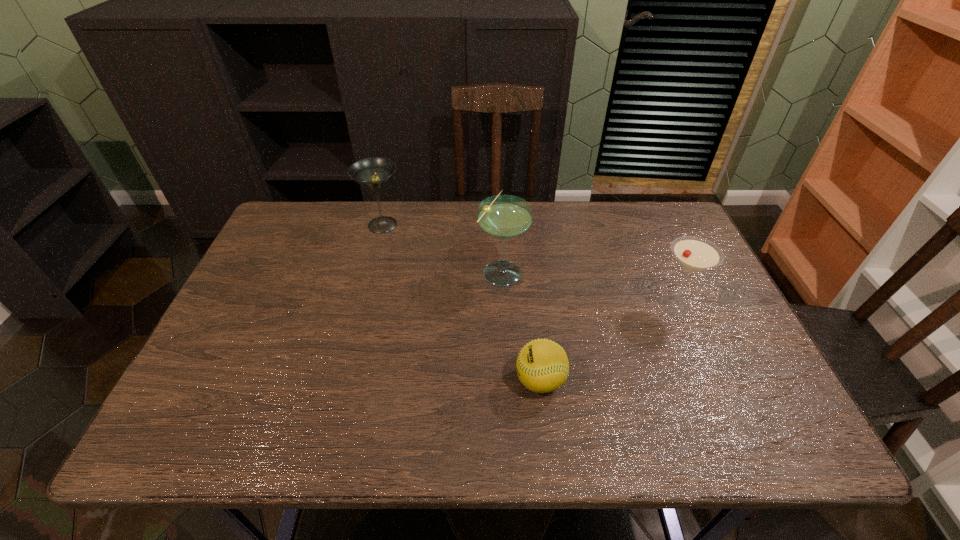
Identify the location of free spot at the near right corner of the desktop. The width and height of the screenshot is (960, 540). (742, 436).

The width and height of the screenshot is (960, 540). Find the location of `free space between the second martini from left to right and the shortest object`. free space between the second martini from left to right and the shortest object is located at coordinates (521, 326).

Locate an element on the screen. The image size is (960, 540). empty location between the nearest object and the leftmost martini is located at coordinates (461, 303).

Where is `vacant space that is in between the nearest object and the second martini from right to left`? vacant space that is in between the nearest object and the second martini from right to left is located at coordinates (521, 326).

Locate an element on the screen. This screenshot has width=960, height=540. unoccupied area between the second martini from right to left and the nearest object is located at coordinates (521, 326).

Find the location of a particular element. This screenshot has width=960, height=540. vacant region between the nearest object and the leftmost object is located at coordinates (461, 303).

Where is `free space between the softball and the leftmost object`? The image size is (960, 540). free space between the softball and the leftmost object is located at coordinates (461, 303).

Locate an element on the screen. The image size is (960, 540). free space between the softball and the farthest object is located at coordinates (461, 303).

Find the location of `free spot between the second martini from right to left and the rightmost martini`. free spot between the second martini from right to left and the rightmost martini is located at coordinates (588, 287).

You are a GUI agent. You are given a task and a screenshot of the screen. Output one action in this format:
    pyautogui.click(x=<x>, y=<y>)
    Task: Click on the vacant space in between the second martini from left to right and the softball
    
    Given the screenshot: What is the action you would take?
    pyautogui.click(x=521, y=326)